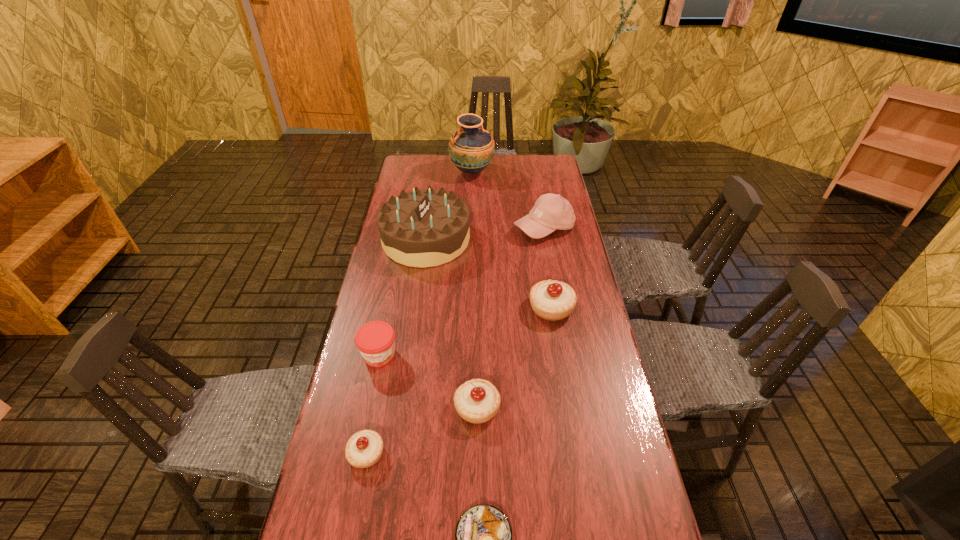
This screenshot has height=540, width=960. I want to click on vacant area situated on the back of the nearest beige pastry, so click(384, 361).

This screenshot has width=960, height=540. Identify the location of object that is positioned at the far edge. (471, 148).

The width and height of the screenshot is (960, 540). Identify the location of birthday cake that is at the left edge. (422, 228).

Where is `jam located at the left edge`? The image size is (960, 540). jam located at the left edge is located at coordinates (375, 340).

I want to click on pastry at the left edge, so click(364, 448).

Where is `baseball cap present at the right edge`? baseball cap present at the right edge is located at coordinates (551, 211).

Locate an element on the screen. pastry that is at the right edge is located at coordinates (552, 300).

In the image, there is a desktop. At what (x,y) coordinates should I click in order to perform the action: click on free region at the far edge. Please return your answer as a coordinate pair (x, y). Looking at the image, I should click on (506, 155).

You are a GUI agent. You are given a task and a screenshot of the screen. Output one action in this format:
    pyautogui.click(x=<x>, y=<y>)
    Task: Click on the free region at the left edge of the desktop
    
    Given the screenshot: What is the action you would take?
    pyautogui.click(x=428, y=185)

Identify the location of vacant space at the right edge. The width and height of the screenshot is (960, 540). (574, 272).